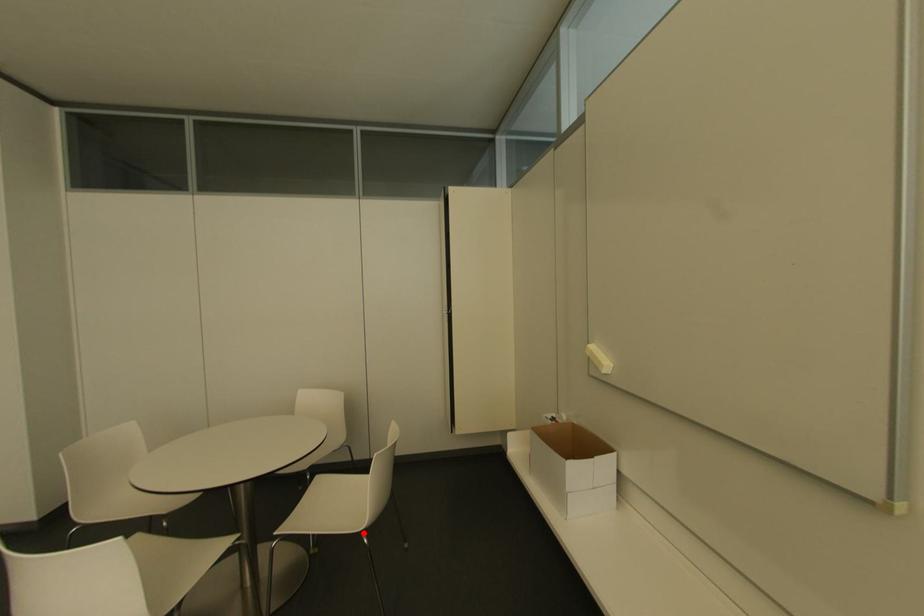
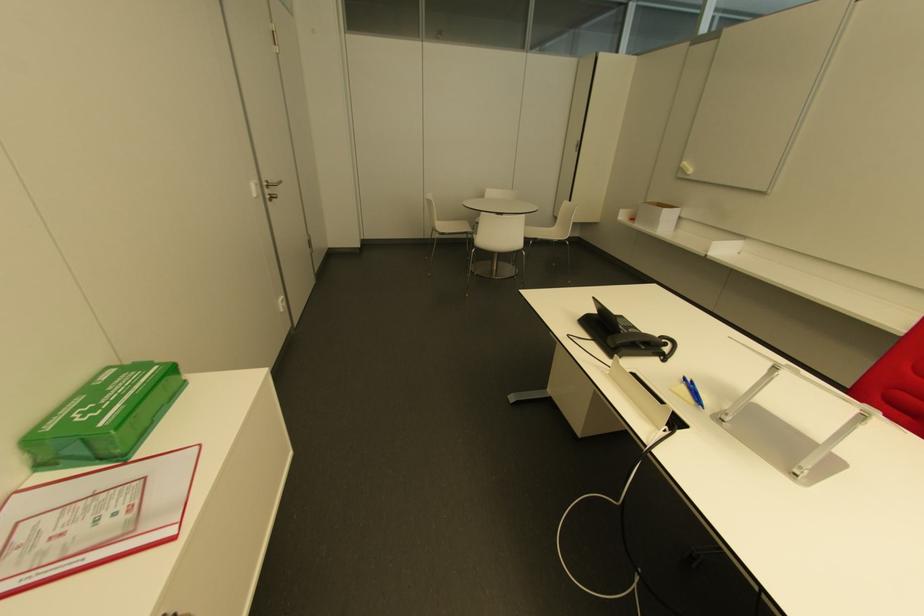
Where in the second image is the point corresponding to the highlighted location from the first image?

(565, 240)